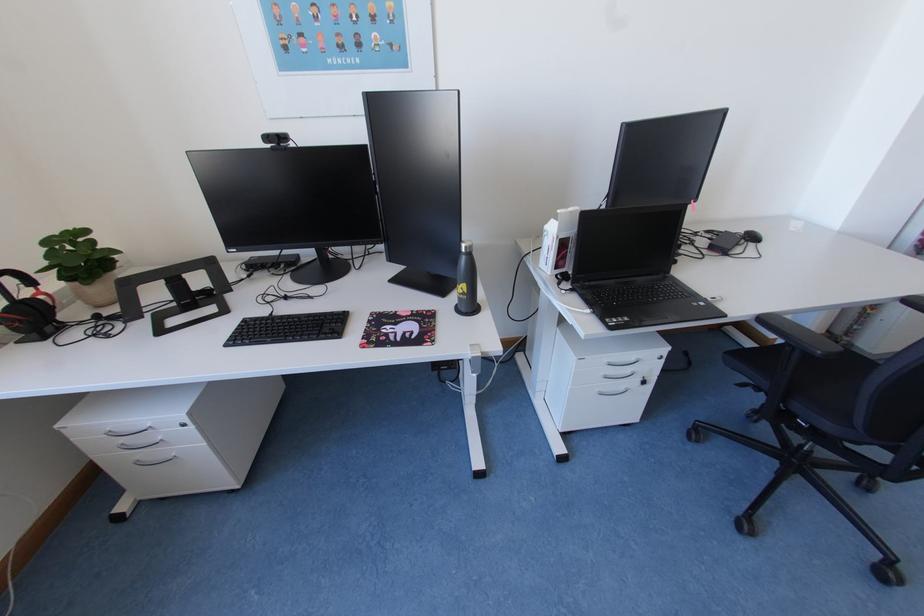
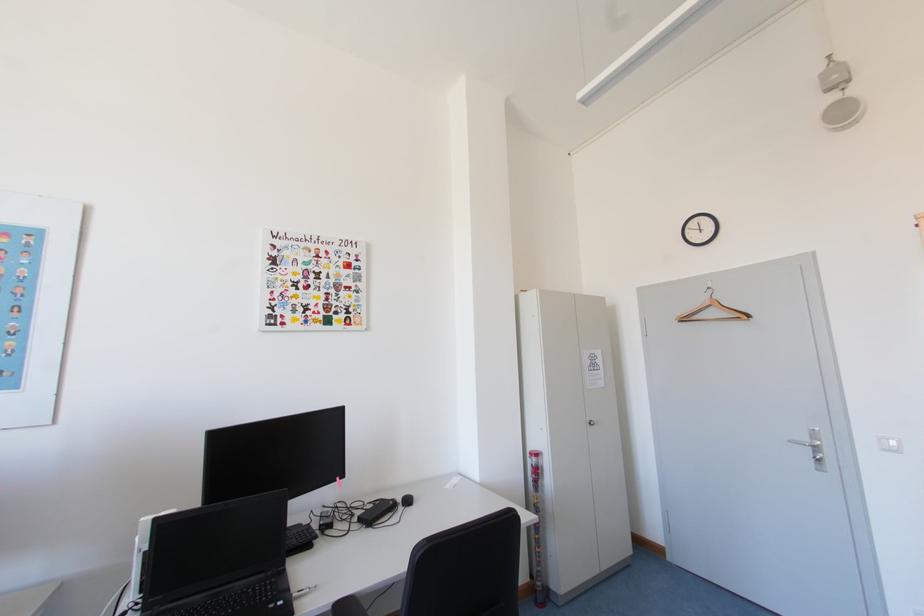
How did the camera likely rotate?

The rotation direction of the camera is right-up.